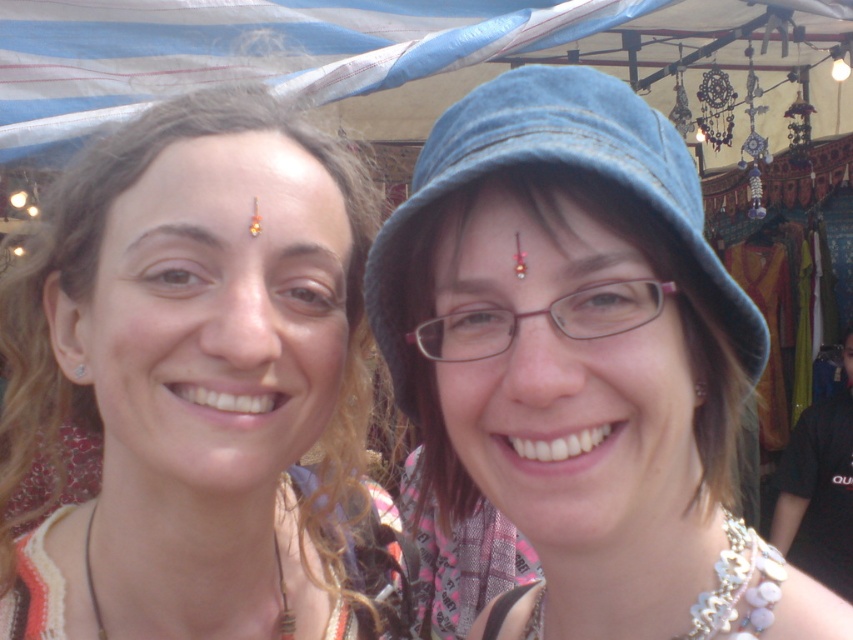
Question: Among these points, which one is nearest to the camera?

Choices:
 (A) (206, 104)
 (B) (88, 540)
 (C) (724, 593)

Answer: (C)

Question: Does denim blue hat at center appear on the left side of pearl-like beads at lower right?

Choices:
 (A) yes
 (B) no

Answer: (A)

Question: Among these objects, which one is nearest to the camera?

Choices:
 (A) leather cord necklace at lower left
 (B) matte gold forehead at center
 (C) matte black hair at center
 (D) pearl-like beads at lower right

Answer: (D)

Question: Is the position of denim blue hat at center more distant than that of leather cord necklace at lower left?

Choices:
 (A) yes
 (B) no

Answer: (B)

Question: Is matte gold forehead at center bigger than pearl-like beads at lower right?

Choices:
 (A) yes
 (B) no

Answer: (B)

Question: Among these points, which one is nearest to the camera?

Choices:
 (A) (310, 179)
 (B) (331, 412)

Answer: (A)